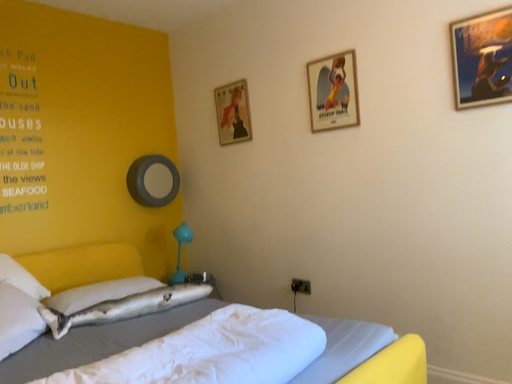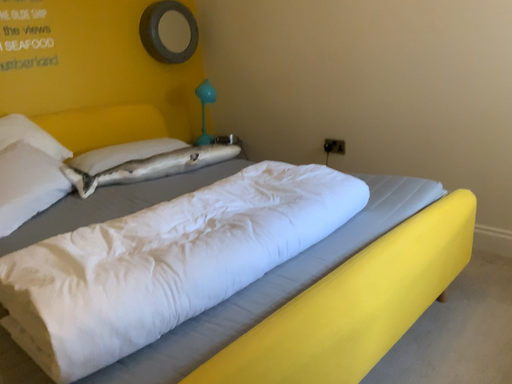
Question: Which way did the camera rotate in the video?

Choices:
 (A) rotated downward
 (B) rotated upward

Answer: (A)